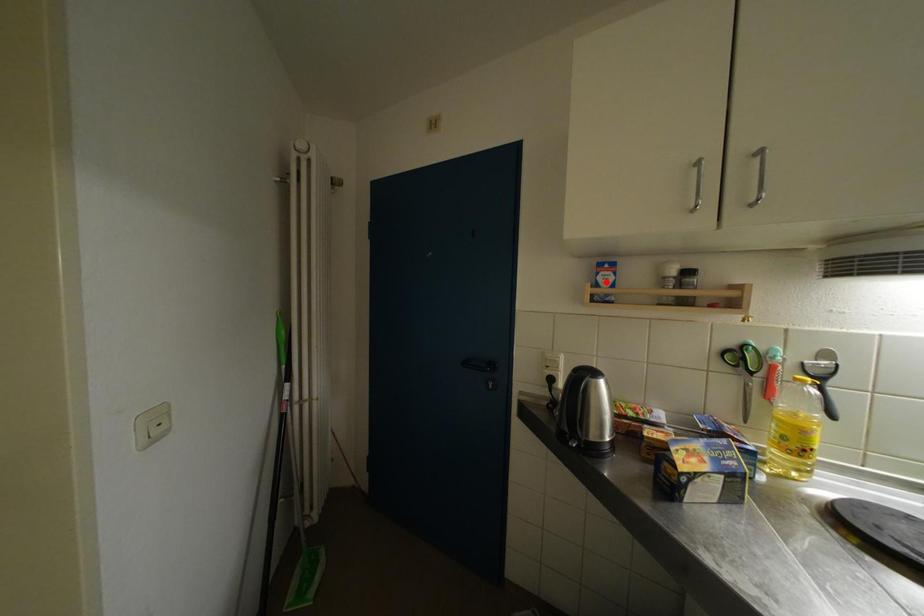
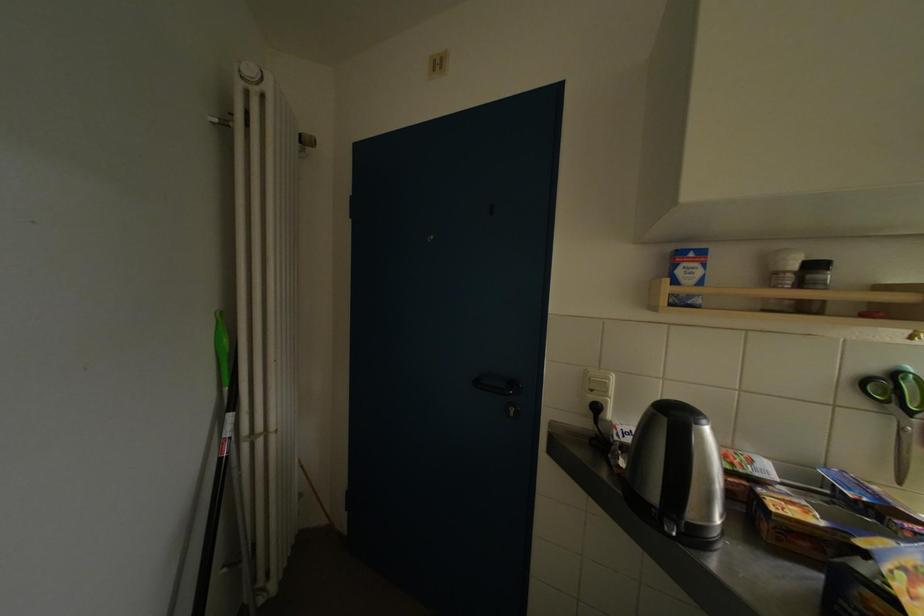
Find the pixel in the second image that matches the highlighted location in the first image.

(686, 276)